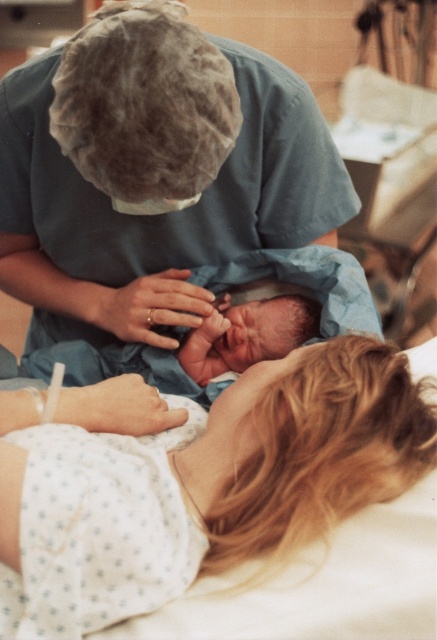
You are a medical professional standing in the hospital room. You need to disinfect an area that is exactly 80 centimeters away from the camera. Is the point at coordinates point (72, 552) within the required distance?

The point point (72, 552) is 81.01 centimeters from the camera, which is slightly beyond the 80 centimeter requirement. Therefore, it is not within the required distance.

You are a patient in the hospital and want to locate the medical staff member wearing the matte blue scrubs at center. Based on the scene description, where would you look in the image?

The medical staff member wearing the matte blue scrubs at center is located at the 2D coordinates point (162, 214) in the image.